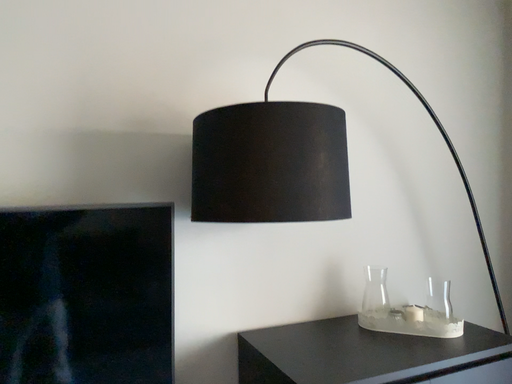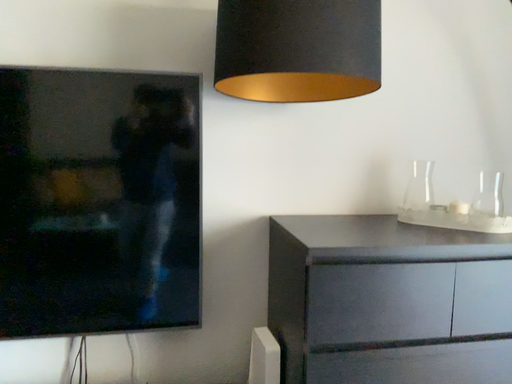
Question: How did the camera likely rotate when shooting the video?

Choices:
 (A) rotated left
 (B) rotated right

Answer: (A)